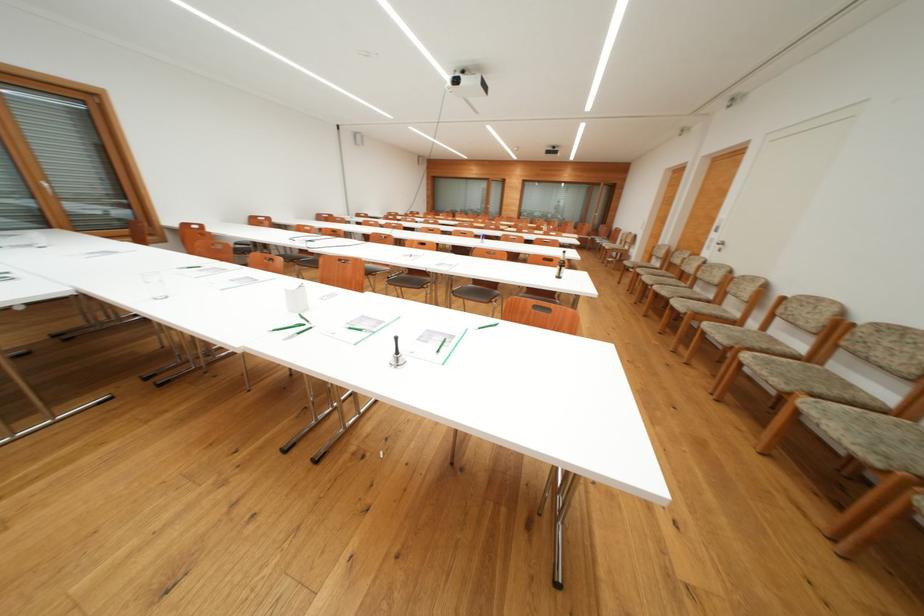
Locate an element on the screen. The image size is (924, 616). silver window handle is located at coordinates (45, 187).